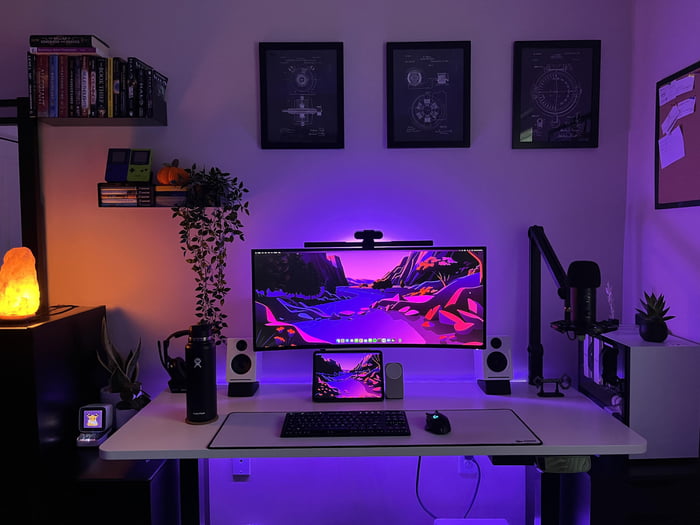
This screenshot has width=700, height=525. I want to click on recording microphone, so click(x=584, y=277).